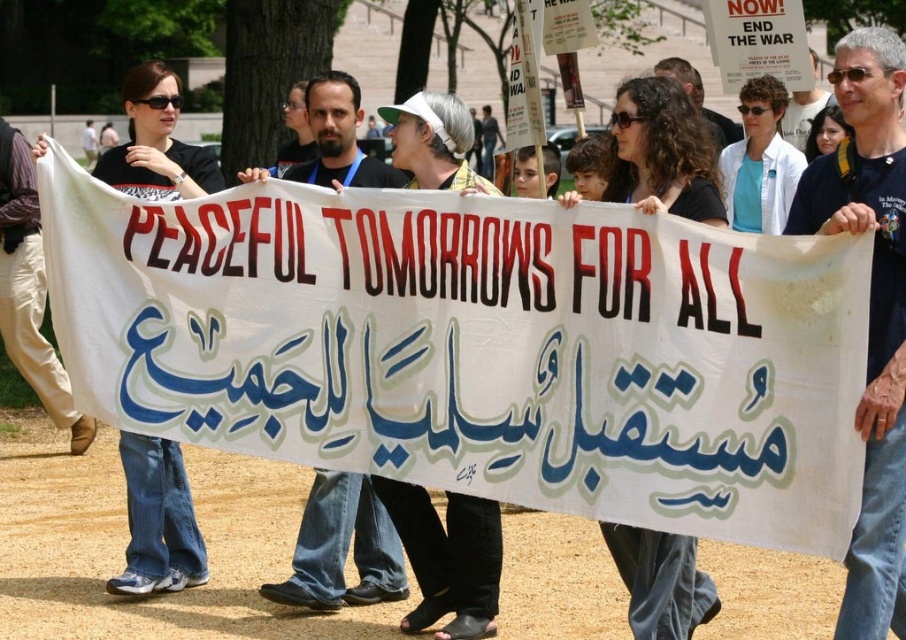
Does dark blue jeans at center have a greater height compared to gray hair at center?

No.

Between point (372, 180) and point (664, 65), which one is positioned in front?

Positioned in front is point (372, 180).

This screenshot has width=906, height=640. In order to click on dark blue jeans at center in this screenshot , I will do `click(342, 547)`.

Who is positioned more to the left, dark blue t-shirt at center or gray hair at center?

Positioned to the left is dark blue t-shirt at center.

Is dark blue t-shirt at center taller than gray hair at center?

Correct, dark blue t-shirt at center is much taller as gray hair at center.

Measure the distance between dark blue t-shirt at center and camera.

A distance of 5.58 meters exists between dark blue t-shirt at center and camera.

Locate an element on the screen. The width and height of the screenshot is (906, 640). dark blue t-shirt at center is located at coordinates (870, 310).

Is dark blue jeans at center below matte black shirt at upper right?

Yes, dark blue jeans at center is below matte black shirt at upper right.

Between point (323, 484) and point (789, 122), which one is positioned behind?

The point (789, 122) is behind.

The height and width of the screenshot is (640, 906). Identify the location of dark blue jeans at center. (342, 547).